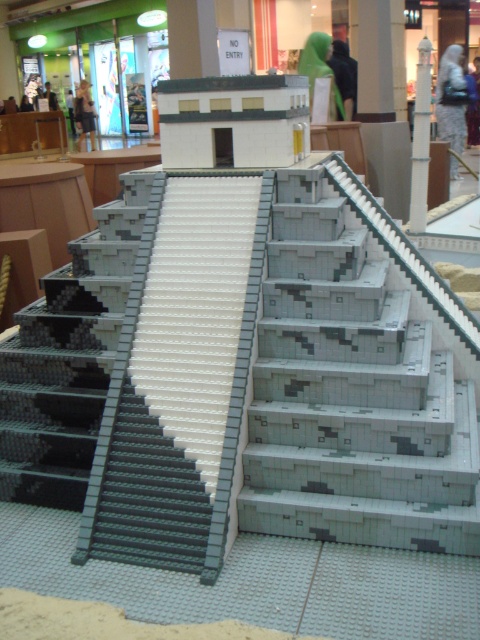
Question: Observing the image, what is the correct spatial positioning of gray lego stairs at center in reference to gray plastic stairs at center?

Choices:
 (A) above
 (B) below

Answer: (A)

Question: Which object is positioned farthest from the gray lego stairs at center?

Choices:
 (A) gray plastic stairs at center
 (B) gray matte stairs at left

Answer: (B)

Question: Which object appears farthest from the camera in this image?

Choices:
 (A) gray lego stairs at center
 (B) gray matte stairs at left
 (C) gray plastic stairs at center

Answer: (B)

Question: Among these points, which one is nearest to the camera?

Choices:
 (A) (237, 502)
 (B) (151, 488)
 (C) (93, 276)

Answer: (A)

Question: Is gray lego stairs at center in front of gray matte stairs at left?

Choices:
 (A) yes
 (B) no

Answer: (A)

Question: Is gray lego stairs at center to the right of gray matte stairs at left from the viewer's perspective?

Choices:
 (A) no
 (B) yes

Answer: (B)